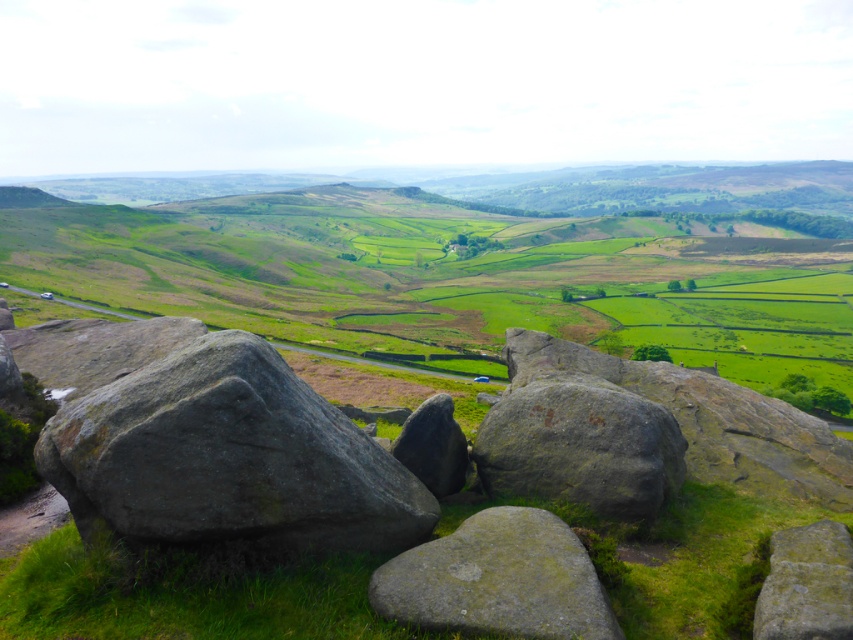
You are a hiker who wants to place a small flag on the highest point between the rough gray rock at center and the green mossy rock at center. Which rock should you choose?

The rough gray rock at center is taller than the green mossy rock at center, so you should choose the rough gray rock at center to place the flag.

You are standing at the point marked as point (498, 580) in the image. What object is directly beneath your feet?

The green mossy rock at center is located at point (498, 580), so the object directly beneath your feet is the green mossy rock at center.